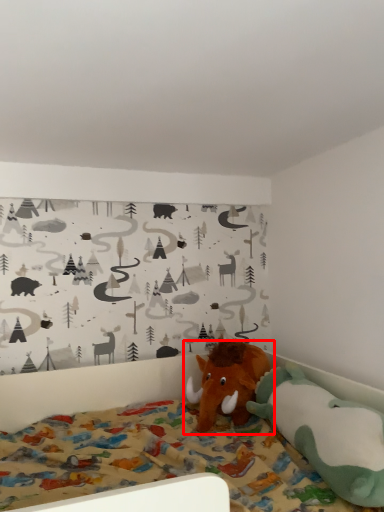
Question: From the image's perspective, considering the relative positions of toy (annotated by the red box) and toy in the image provided, where is toy (annotated by the red box) located with respect to the staircase?

Choices:
 (A) above
 (B) below

Answer: (A)